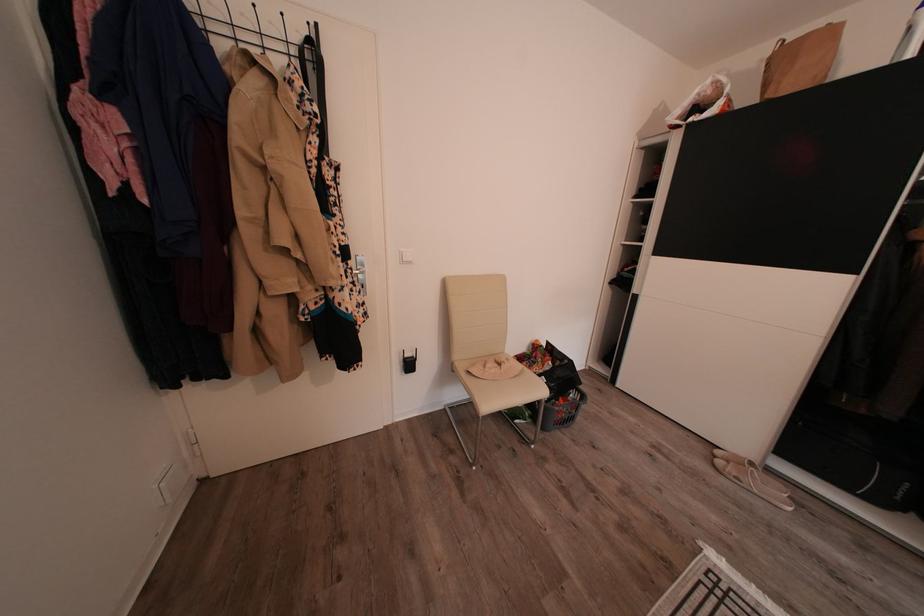
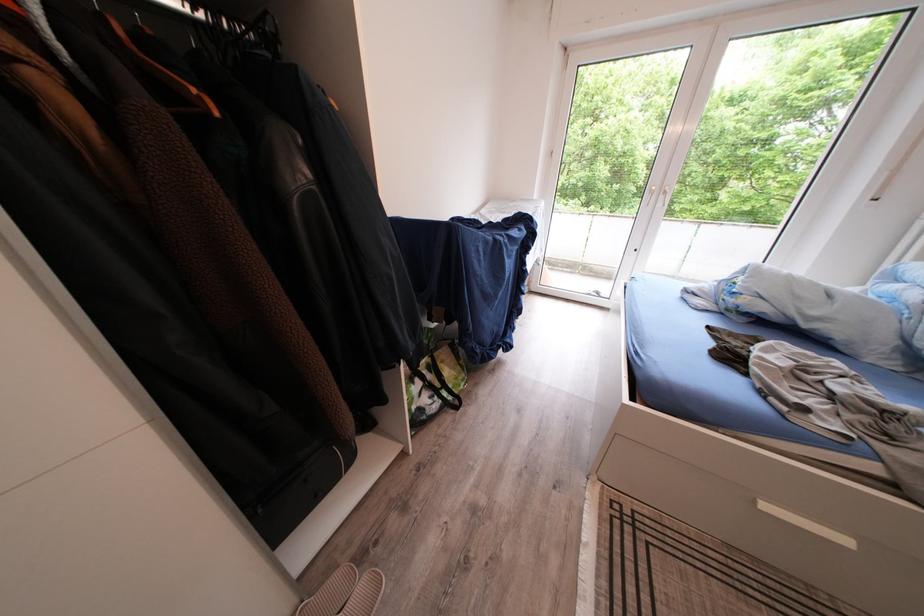
Find the pixel in the second image that matches pixel 786 488 in the first image.

(347, 583)